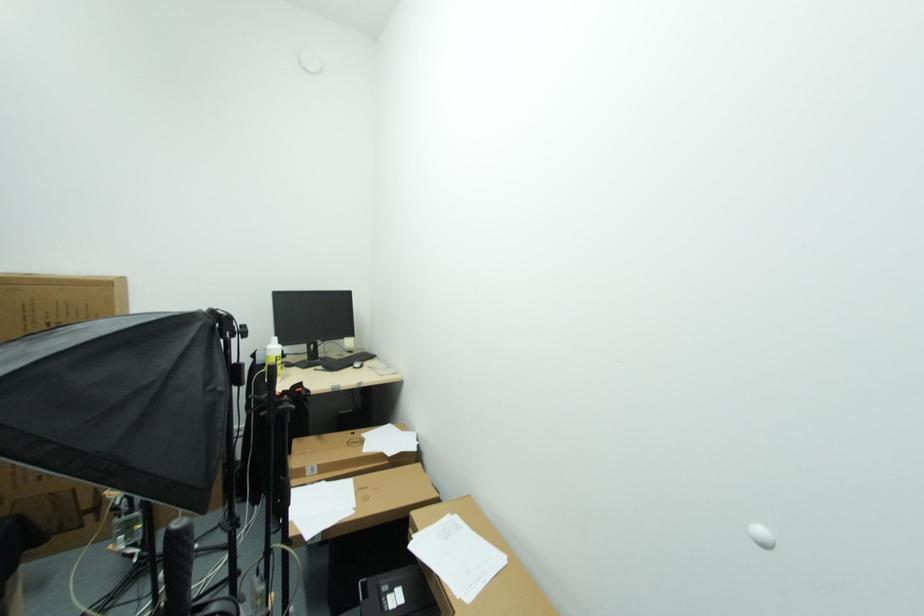
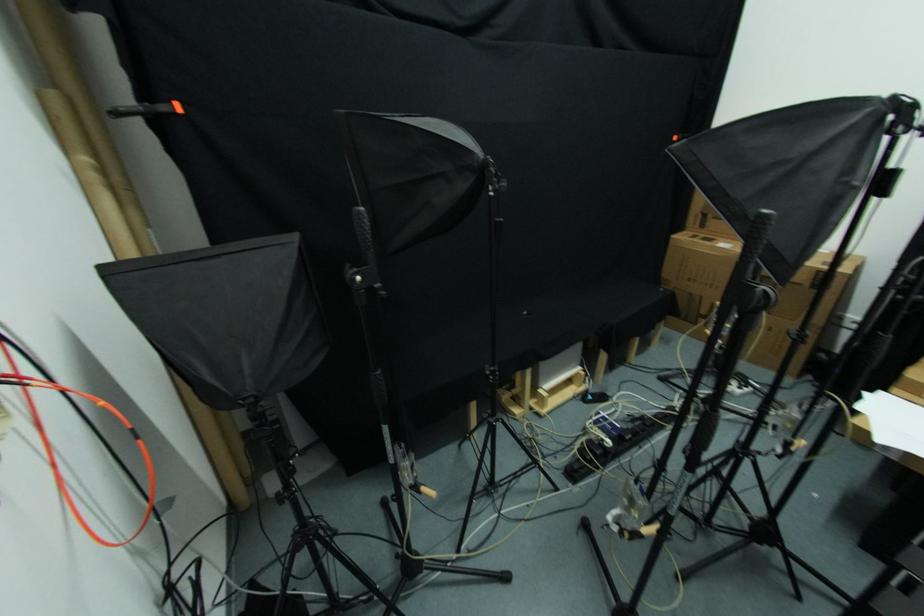
Consider the image. First-person continuous shooting, in which direction is the camera rotating?

The rotation direction of the camera is left-down.